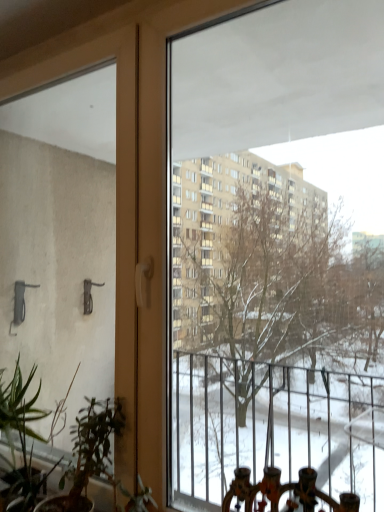
Question: Is green matte plant at lower left positioned with its back to green matte plant at lower left?

Choices:
 (A) no
 (B) yes

Answer: (A)

Question: Can you confirm if green matte plant at lower left is taller than green matte plant at lower left?

Choices:
 (A) yes
 (B) no

Answer: (A)

Question: Is green matte plant at lower left to the right of green matte plant at lower left from the viewer's perspective?

Choices:
 (A) yes
 (B) no

Answer: (B)

Question: Is the position of green matte plant at lower left more distant than that of green matte plant at lower left?

Choices:
 (A) yes
 (B) no

Answer: (A)

Question: From a real-world perspective, is green matte plant at lower left beneath green matte plant at lower left?

Choices:
 (A) no
 (B) yes

Answer: (A)

Question: Is green matte plant at lower left to the left of green matte plant at lower left from the viewer's perspective?

Choices:
 (A) no
 (B) yes

Answer: (B)

Question: Can you confirm if green matte plant at lower left is thinner than green matte plant at lower left?

Choices:
 (A) yes
 (B) no

Answer: (B)

Question: From a real-world perspective, is green matte plant at lower left beneath green matte plant at lower left?

Choices:
 (A) no
 (B) yes

Answer: (B)

Question: Considering the relative sizes of green matte plant at lower left and green matte plant at lower left in the image provided, is green matte plant at lower left taller than green matte plant at lower left?

Choices:
 (A) yes
 (B) no

Answer: (B)

Question: Considering the relative sizes of green matte plant at lower left and green matte plant at lower left in the image provided, is green matte plant at lower left wider than green matte plant at lower left?

Choices:
 (A) yes
 (B) no

Answer: (A)

Question: From the image's perspective, is green matte plant at lower left below green matte plant at lower left?

Choices:
 (A) no
 (B) yes

Answer: (B)

Question: From the image's perspective, is green matte plant at lower left over green matte plant at lower left?

Choices:
 (A) no
 (B) yes

Answer: (A)

Question: From a real-world perspective, is green matte plant at lower left positioned above or below green matte plant at lower left?

Choices:
 (A) below
 (B) above

Answer: (B)